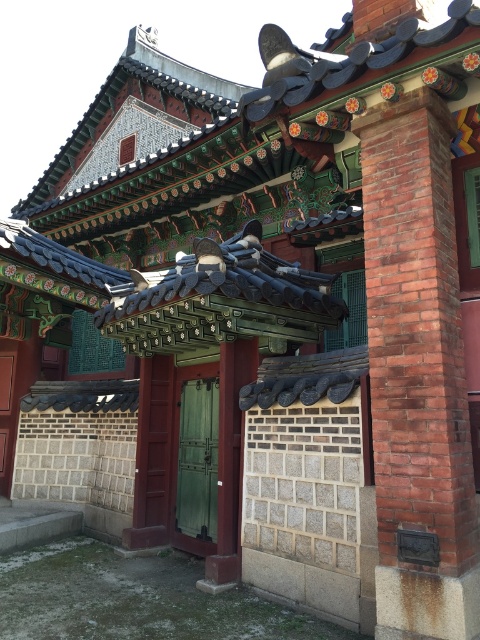
Question: Observing the image, what is the correct spatial positioning of red brick pillar at right in reference to green wooden door at center?

Choices:
 (A) above
 (B) below

Answer: (A)

Question: Can you confirm if red brick pillar at right is smaller than green wooden door at center?

Choices:
 (A) yes
 (B) no

Answer: (B)

Question: Can you confirm if red brick pillar at right is bigger than green wooden door at center?

Choices:
 (A) yes
 (B) no

Answer: (A)

Question: Which object is farther from the camera taking this photo?

Choices:
 (A) red brick pillar at right
 (B) green wooden door at center

Answer: (B)

Question: Among these points, which one is nearest to the camera?

Choices:
 (A) (412, 584)
 (B) (191, 486)

Answer: (A)